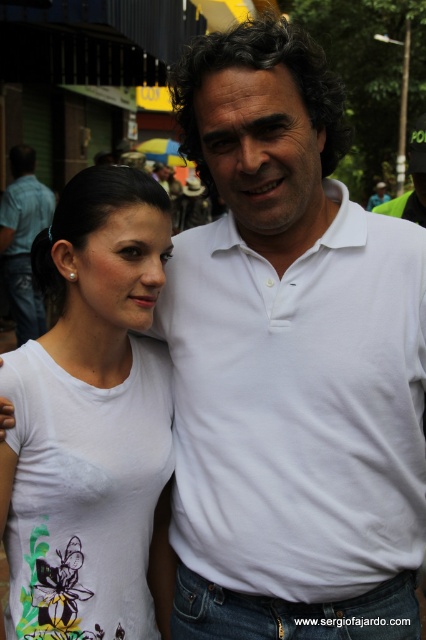
Who is taller, white matte t-shirt at center or matte white shirt at center?

matte white shirt at center

Which is in front, point (158, 625) or point (46, 323)?

Positioned in front is point (158, 625).

I want to click on white matte t-shirt at center, so tap(103, 269).

Based on the photo, can you confirm if white cotton shirt at center is thinner than matte white shirt at center?

No, white cotton shirt at center is not thinner than matte white shirt at center.

Which is in front, point (302, 584) or point (46, 189)?

Positioned in front is point (302, 584).

Locate an element on the screen. white cotton shirt at center is located at coordinates (299, 406).

Can you confirm if white cotton shirt at center is smaller than white matte t-shirt at center?

No.

Image resolution: width=426 pixels, height=640 pixels. I want to click on white cotton shirt at center, so click(x=299, y=406).